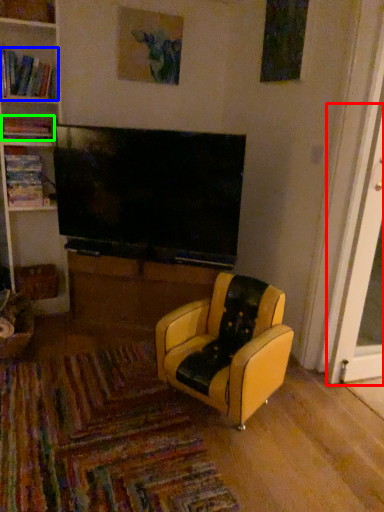
Question: Considering the real-world distances, which object is closest to screen door (highlighted by a red box)? book (highlighted by a blue box) or book (highlighted by a green box).

Choices:
 (A) book
 (B) book

Answer: (B)